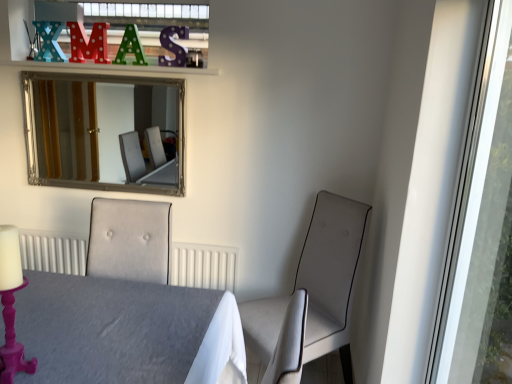
Image resolution: width=512 pixels, height=384 pixels. Identify the location of transparent glass window at right. (483, 229).

From the picture: What is the approximate height of smooth gray table at center?

smooth gray table at center is 16.50 inches in height.

Find the location of a particular element. The height and width of the screenshot is (384, 512). pink painted wood candle holder at lower left is located at coordinates (11, 305).

This screenshot has width=512, height=384. Identify the location of silver/glass mirror at upper left. (105, 132).

The width and height of the screenshot is (512, 384). Describe the element at coordinates (89, 43) in the screenshot. I see `polka dot wooden letter m at upper center, the 2th alphabet in the left-to-right sequence` at that location.

The height and width of the screenshot is (384, 512). What are the coordinates of `polka dot wooden letter m at upper center, the 2th alphabet in the left-to-right sequence` in the screenshot? It's located at (89, 43).

Find the location of a particular element. The width and height of the screenshot is (512, 384). transparent glass window at right is located at coordinates (483, 229).

Is suede-like beige chair at right facing towards smooth gray table at center?

No.

Can you tell me how much suede-like beige chair at right and smooth gray table at center differ in facing direction?

The angle between the facing direction of suede-like beige chair at right and the facing direction of smooth gray table at center is 40.5 degrees.

Would you say smooth gray table at center is part of suede-like beige chair at right's contents?

No, smooth gray table at center is not surrounded by suede-like beige chair at right.

Is suede-like beige chair at right directly adjacent to smooth gray table at center?

No, suede-like beige chair at right is not in contact with smooth gray table at center.

You are a GUI agent. You are given a task and a screenshot of the screen. Output one action in this format:
    pyautogui.click(x=<x>, y=<y>)
    Task: Click on the window located in front of the suede-like beige chair at right
    The width and height of the screenshot is (512, 384).
    Given the screenshot: What is the action you would take?
    pyautogui.click(x=483, y=229)

In terms of size, does suede-like beige chair at right appear bigger or smaller than transparent glass window at right?

Clearly, suede-like beige chair at right is larger in size than transparent glass window at right.

From the image's perspective, would you say suede-like beige chair at right is positioned over transparent glass window at right?

No, from the image's perspective, suede-like beige chair at right is not on top of transparent glass window at right.

From a real-world perspective, between suede-like beige chair at right and transparent glass window at right, who is vertically higher?

From a 3D spatial view, transparent glass window at right is above.

Could you tell me if smooth gray table at center is facing green polka dot letter a at upper center, the third alphabet in the left-to-right sequence?

No, smooth gray table at center is not turned towards green polka dot letter a at upper center, the third alphabet in the left-to-right sequence.

From a real-world perspective, is smooth gray table at center on top of green polka dot letter a at upper center, which appears as the 1th alphabet when viewed from the right?

Actually, smooth gray table at center is physically below green polka dot letter a at upper center, which appears as the 1th alphabet when viewed from the right, in the real world.

In terms of height, does smooth gray table at center look taller or shorter compared to green polka dot letter a at upper center, which appears as the 1th alphabet when viewed from the right?

smooth gray table at center is taller than green polka dot letter a at upper center, which appears as the 1th alphabet when viewed from the right.

Is smooth gray table at center in contact with green polka dot letter a at upper center, the third alphabet in the left-to-right sequence?

smooth gray table at center is not next to green polka dot letter a at upper center, the third alphabet in the left-to-right sequence, and they're not touching.

Does pink painted wood candle holder at lower left have a lesser height compared to polka dot wooden letter m at upper center, the 2th alphabet in the left-to-right sequence?

In fact, pink painted wood candle holder at lower left may be taller than polka dot wooden letter m at upper center, the 2th alphabet in the left-to-right sequence.

From the image's perspective, between pink painted wood candle holder at lower left and polka dot wooden letter m at upper center, the 2th alphabet in the left-to-right sequence, who is located below?

pink painted wood candle holder at lower left is shown below in the image.

Is pink painted wood candle holder at lower left far away from polka dot wooden letter m at upper center, which is the 2th alphabet in right-to-left order?

Yes, pink painted wood candle holder at lower left and polka dot wooden letter m at upper center, which is the 2th alphabet in right-to-left order, are quite far apart.

From a real-world perspective, is pink painted wood candle holder at lower left positioned under polka dot wooden letter m at upper center, the 2th alphabet in the left-to-right sequence, based on gravity?

Yes, from a real-world perspective, pink painted wood candle holder at lower left is below polka dot wooden letter m at upper center, the 2th alphabet in the left-to-right sequence.

Which is in front, point (27, 107) or point (153, 304)?

The point (153, 304) is closer to the camera.

Are silver/glass mirror at upper left and smooth gray table at center located far from each other?

That's right, there is a large distance between silver/glass mirror at upper left and smooth gray table at center.

From the image's perspective, between silver/glass mirror at upper left and smooth gray table at center, who is located below?

smooth gray table at center, from the image's perspective.

Which is in front, silver/glass mirror at upper left or smooth gray table at center?

Positioned in front is smooth gray table at center.

Consider the image. Does polka dot wooden letter m at upper center, the 2th alphabet in the left-to-right sequence, have a lesser width compared to silver/glass mirror at upper left?

Yes.

Considering the relative sizes of polka dot wooden letter m at upper center, which is the 2th alphabet in right-to-left order, and silver/glass mirror at upper left in the image provided, is polka dot wooden letter m at upper center, which is the 2th alphabet in right-to-left order, bigger than silver/glass mirror at upper left?

No, polka dot wooden letter m at upper center, which is the 2th alphabet in right-to-left order, is not bigger than silver/glass mirror at upper left.

From the image's perspective, which is above, polka dot wooden letter m at upper center, which is the 2th alphabet in right-to-left order, or silver/glass mirror at upper left?

polka dot wooden letter m at upper center, which is the 2th alphabet in right-to-left order, from the image's perspective.

Which is behind, point (77, 57) or point (182, 99)?

The point (77, 57) is behind.

Which is in front, point (4, 329) or point (2, 253)?

The point (2, 253) is closer to the camera.

Measure the distance from smooth gray table at center to pink painted wood candle holder at lower left.

11.69 inches.

From the image's perspective, which is above, smooth gray table at center or pink painted wood candle holder at lower left?

From the image's view, pink painted wood candle holder at lower left is above.

What's the angular difference between smooth gray table at center and pink painted wood candle holder at lower left's facing directions?

The angle between the facing direction of smooth gray table at center and the facing direction of pink painted wood candle holder at lower left is 1.04 degrees.

In the image, there is a smooth gray table at center. Where is `chair below it (from the image's perspective)`? The height and width of the screenshot is (384, 512). chair below it (from the image's perspective) is located at coordinates (330, 270).

Where is `chair on the left of transparent glass window at right`? chair on the left of transparent glass window at right is located at coordinates (330, 270).

From the image, which object appears to be nearer to silver/glass mirror at upper left, suede-like beige chair at right or smooth gray table at center?

The object closer to silver/glass mirror at upper left is suede-like beige chair at right.

From the image, which object appears to be farther from suede-like beige chair at right, polka dot wooden letter m at upper center, the 2th alphabet in the left-to-right sequence, or green polka dot letter a at upper center, the third alphabet in the left-to-right sequence?

Based on the image, polka dot wooden letter m at upper center, the 2th alphabet in the left-to-right sequence, appears to be further to suede-like beige chair at right.

From the image, which object appears to be nearer to polka dot wooden letter m at upper center, the 2th alphabet in the left-to-right sequence, teal felt letter x at upper left, which is the 3th alphabet from right to left, or suede-like beige chair at right?

teal felt letter x at upper left, which is the 3th alphabet from right to left, is positioned closer to the anchor polka dot wooden letter m at upper center, the 2th alphabet in the left-to-right sequence.

From the image, which object appears to be farther from teal felt letter x at upper left, placed as the first alphabet when sorted from left to right, smooth gray table at center or polka dot wooden letter m at upper center, the 2th alphabet in the left-to-right sequence?

smooth gray table at center lies further to teal felt letter x at upper left, placed as the first alphabet when sorted from left to right, than the other object.

Based on their spatial positions, is polka dot wooden letter m at upper center, which is the 2th alphabet in right-to-left order, or pink painted wood candle holder at lower left closer to silver/glass mirror at upper left?

polka dot wooden letter m at upper center, which is the 2th alphabet in right-to-left order, is positioned closer to the anchor silver/glass mirror at upper left.

Looking at the image, which one is located further to pink painted wood candle holder at lower left, green polka dot letter a at upper center, which appears as the 1th alphabet when viewed from the right, or smooth gray table at center?

green polka dot letter a at upper center, which appears as the 1th alphabet when viewed from the right, is further to pink painted wood candle holder at lower left.

Looking at the image, which one is located closer to silver/glass mirror at upper left, pink painted wood candle holder at lower left or suede-like beige chair at right?

suede-like beige chair at right.

When comparing their distances from transparent glass window at right, does smooth gray table at center or suede-like beige chair at right seem further?

smooth gray table at center.

Image resolution: width=512 pixels, height=384 pixels. Identify the location of alphabet positioned between smooth gray table at center and polka dot wooden letter m at upper center, which is the 2th alphabet in right-to-left order, from near to far. (130, 47).

Where is `alphabet located between teal felt letter x at upper left, which is the 3th alphabet from right to left, and green polka dot letter a at upper center, the third alphabet in the left-to-right sequence, in the left-right direction`? This screenshot has width=512, height=384. alphabet located between teal felt letter x at upper left, which is the 3th alphabet from right to left, and green polka dot letter a at upper center, the third alphabet in the left-to-right sequence, in the left-right direction is located at coordinates (89, 43).

This screenshot has width=512, height=384. I want to click on table situated between pink painted wood candle holder at lower left and transparent glass window at right from left to right, so click(x=126, y=332).

Locate an element on the screen. chair between smooth gray table at center and green polka dot letter a at upper center, the third alphabet in the left-to-right sequence, along the z-axis is located at coordinates pos(330,270).